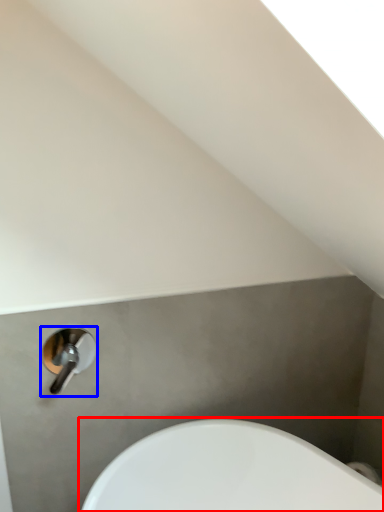
Question: Which point is closer to the camera, sink (highlighted by a red box) or tap (highlighted by a blue box)?

Choices:
 (A) sink
 (B) tap

Answer: (A)